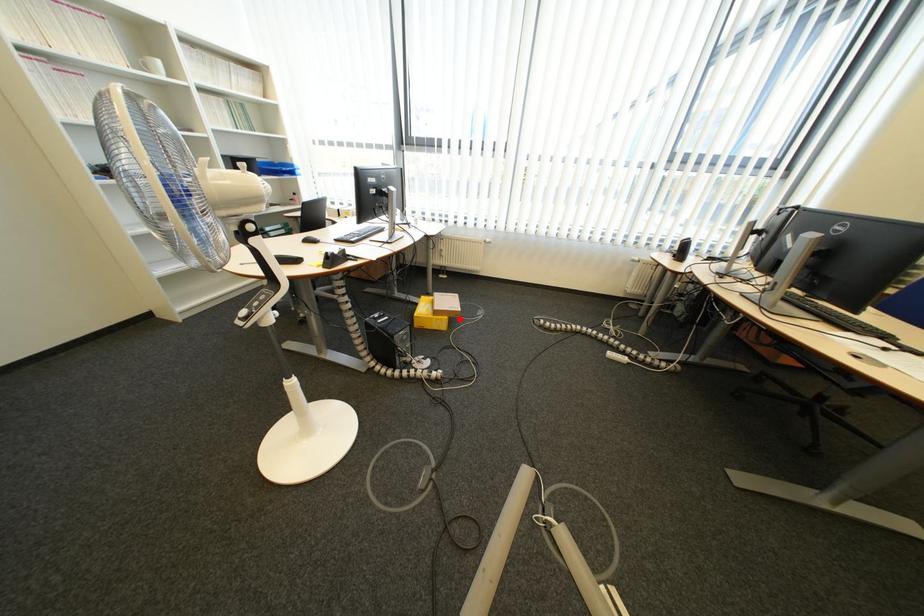
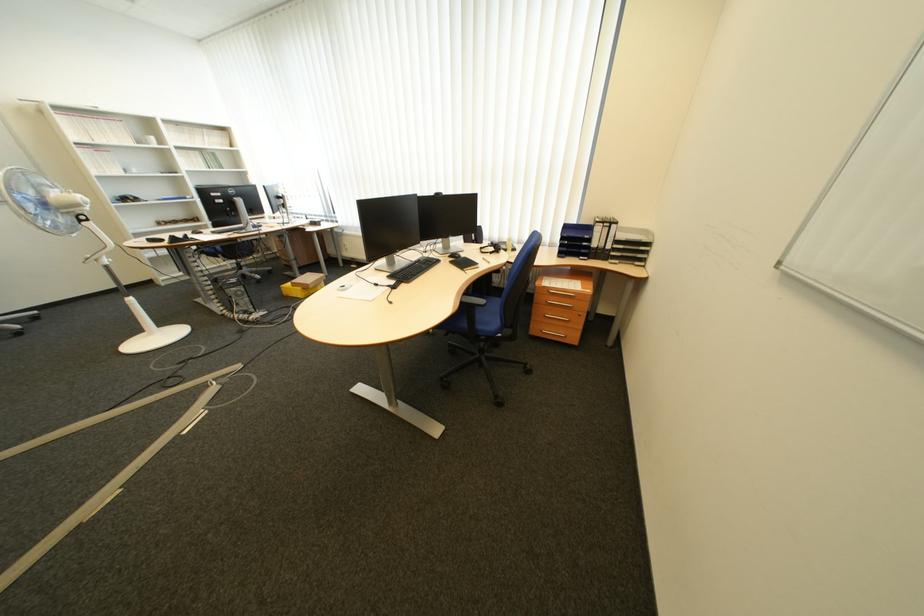
Question: I am providing you with two images of the same scene from different viewpoints. Given a red point in image1, look at the same physical point in image2. Is it:

Choices:
 (A) Closer to the viewpoint
 (B) Farther from the viewpoint

Answer: (B)